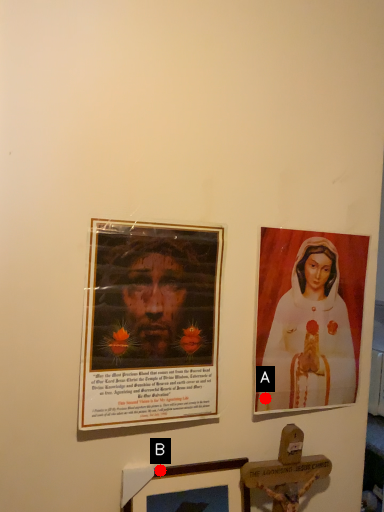
Question: Two points are circled on the image, labeled by A and B beside each circle. Which point is farther from the camera taking this photo?

Choices:
 (A) A is further
 (B) B is further

Answer: (A)